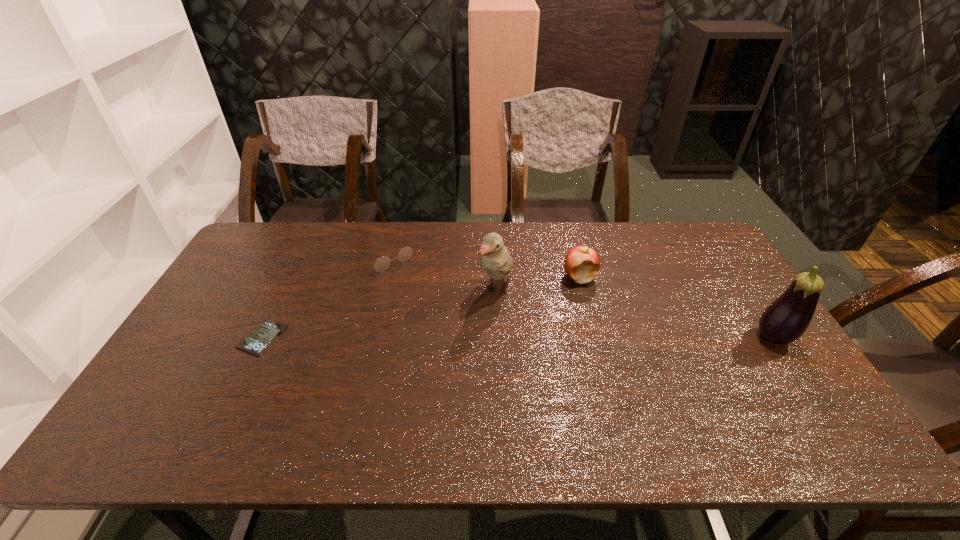
This screenshot has height=540, width=960. In order to click on vacant area located 0.340m on the bitten side of the third tallest object in this screenshot , I will do `click(509, 352)`.

Find the location of a particular element. free space located on the bitten side of the third tallest object is located at coordinates (563, 294).

Where is `vacant space located on the bitten side of the third tallest object`? Image resolution: width=960 pixels, height=540 pixels. vacant space located on the bitten side of the third tallest object is located at coordinates (527, 332).

Find the location of a particular element. Image resolution: width=960 pixels, height=540 pixels. vacant area situated 0.140m on the temples of the second shortest object is located at coordinates point(421,294).

Locate an element on the screen. The image size is (960, 540). free space located on the temples of the second shortest object is located at coordinates (420, 293).

The image size is (960, 540). I want to click on vacant space situated 0.260m on the temples of the second shortest object, so click(x=444, y=317).

Where is `vacant region located 0.370m at the face of the bird`? vacant region located 0.370m at the face of the bird is located at coordinates (421, 403).

Find the location of a particular element. The width and height of the screenshot is (960, 540). vacant space located at the face of the bird is located at coordinates (419, 407).

Where is `free spot located 0.250m at the face of the bird`? The height and width of the screenshot is (540, 960). free spot located 0.250m at the face of the bird is located at coordinates (446, 368).

Where is `object at the far edge`? object at the far edge is located at coordinates (382, 263).